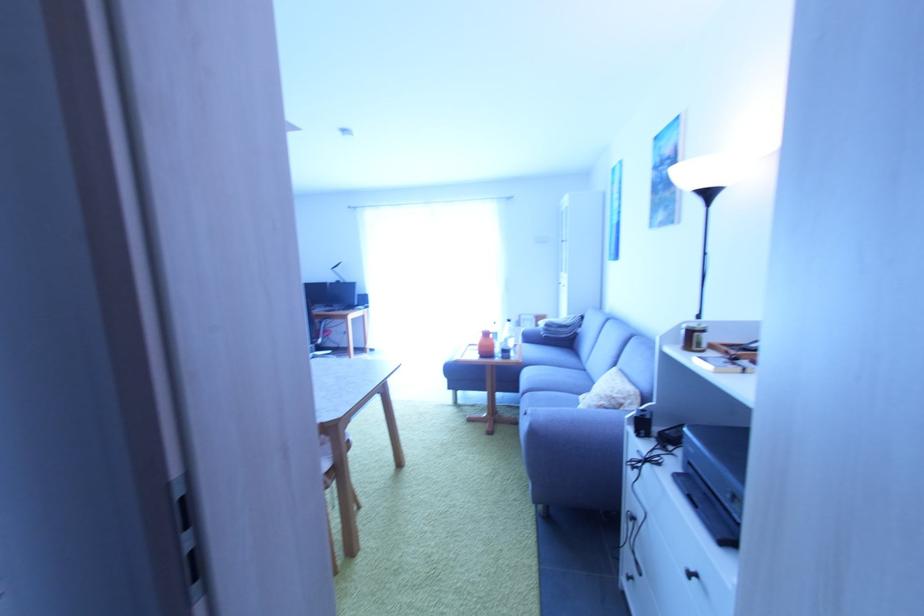
This screenshot has height=616, width=924. What do you see at coordinates (554, 379) in the screenshot? I see `a sofa sitting surface` at bounding box center [554, 379].